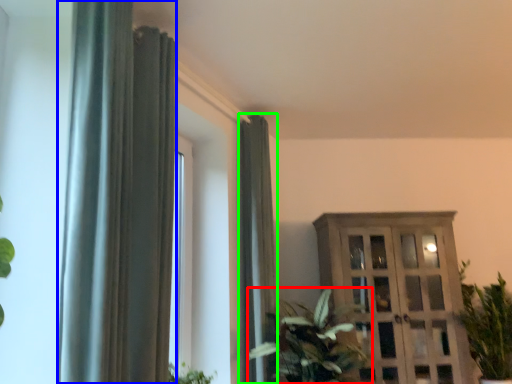
Question: Which object is the farthest from houseplant (highlighted by a red box)? Choose among these: curtain (highlighted by a blue box) or curtain (highlighted by a green box).

Choices:
 (A) curtain
 (B) curtain

Answer: (A)